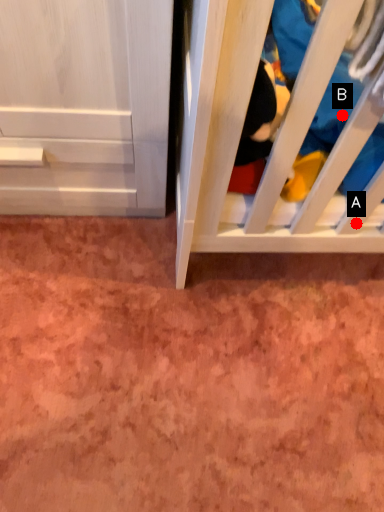
Question: Two points are circled on the image, labeled by A and B beside each circle. Among these points, which one is farthest from the camera?

Choices:
 (A) A is further
 (B) B is further

Answer: (A)